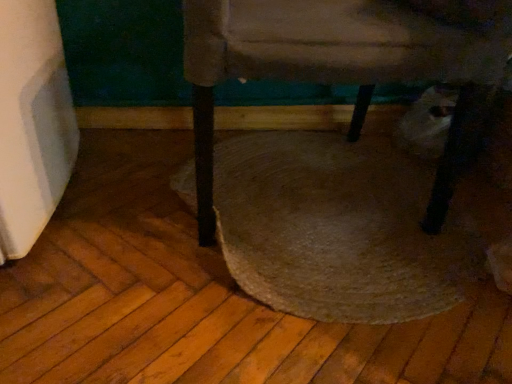
This screenshot has width=512, height=384. Find the location of `vacant region to the left of rug at center`. vacant region to the left of rug at center is located at coordinates (117, 236).